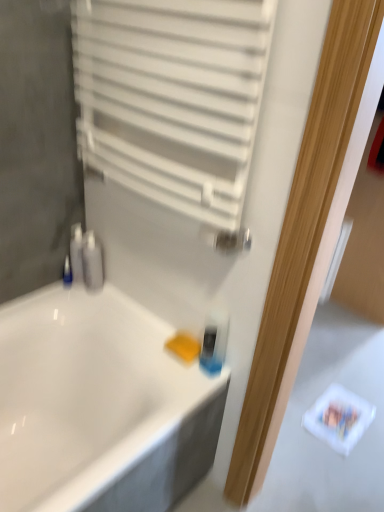
Question: Would you say yellow sponge at lower center is to the left or to the right of satin silver soap dispenser at left, the 1th toiletry positioned from the right, in the picture?

Choices:
 (A) right
 (B) left

Answer: (A)

Question: Does point coord(188,346) appear closer or farther from the camera than point coord(89,262)?

Choices:
 (A) closer
 (B) farther

Answer: (A)

Question: Estimate the real-world distances between objects in this image. Which object is closer to the blue plastic bottle at left, which appears as the 2th toiletry when viewed from the right?

Choices:
 (A) white matte radiator at upper center
 (B) yellow sponge at lower center
 (C) translucent plastic mouthwash at center
 (D) satin silver soap dispenser at left, the 1th toiletry positioned from the right
 (E) white glossy bathtub at center

Answer: (D)

Question: Which is farther from the white glossy bathtub at center?

Choices:
 (A) translucent plastic mouthwash at center
 (B) blue plastic bottle at left, which appears as the 2th toiletry when viewed from the right
 (C) satin silver soap dispenser at left, positioned as the 2th toiletry in left-to-right order
 (D) white matte radiator at upper center
 (E) yellow sponge at lower center

Answer: (D)